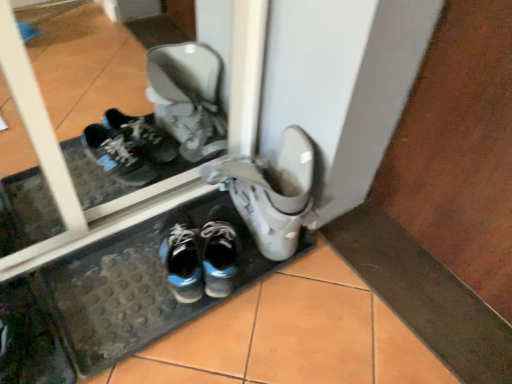
Locate an element on the screen. vacant space to the right of blue synthetic sneakers at center, positioned as the 2th footwear in right-to-left order is located at coordinates (270, 258).